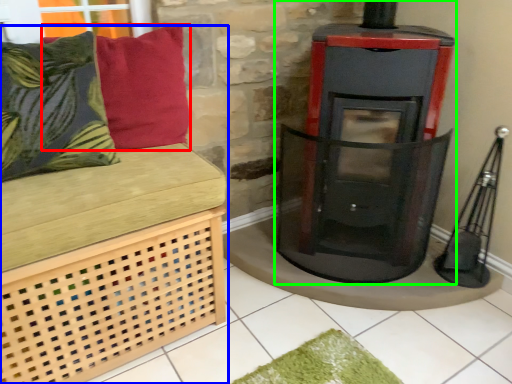
Question: Based on their relative distances, which object is farther from pillow (highlighted by a red box)? Choose from furniture (highlighted by a blue box) and wood burning stove (highlighted by a green box).

Choices:
 (A) furniture
 (B) wood burning stove

Answer: (B)